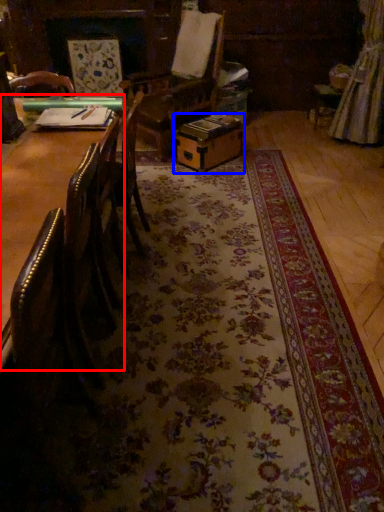
Question: Which of the following is the farthest to the observer, table (highlighted by a red box) or cardboard box (highlighted by a blue box)?

Choices:
 (A) table
 (B) cardboard box

Answer: (B)